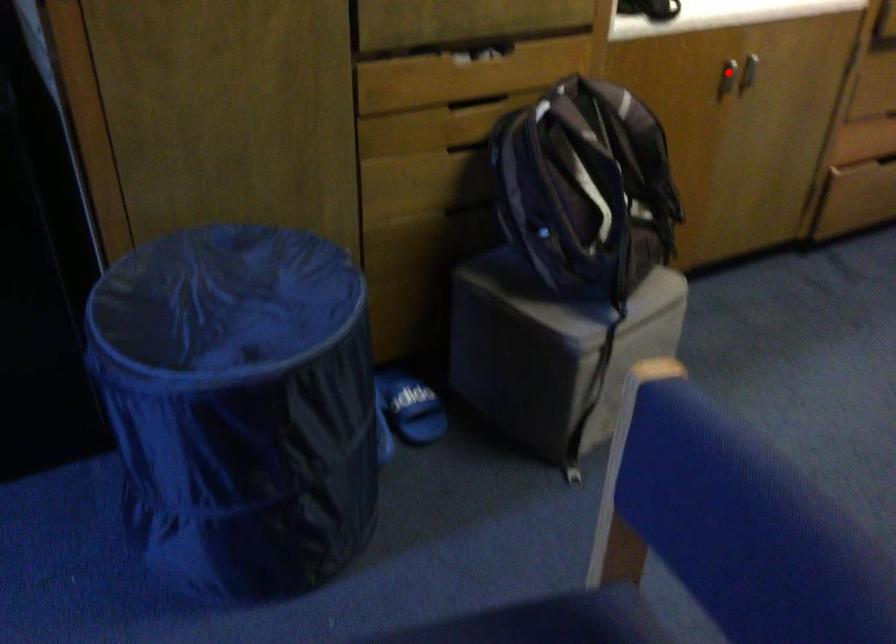
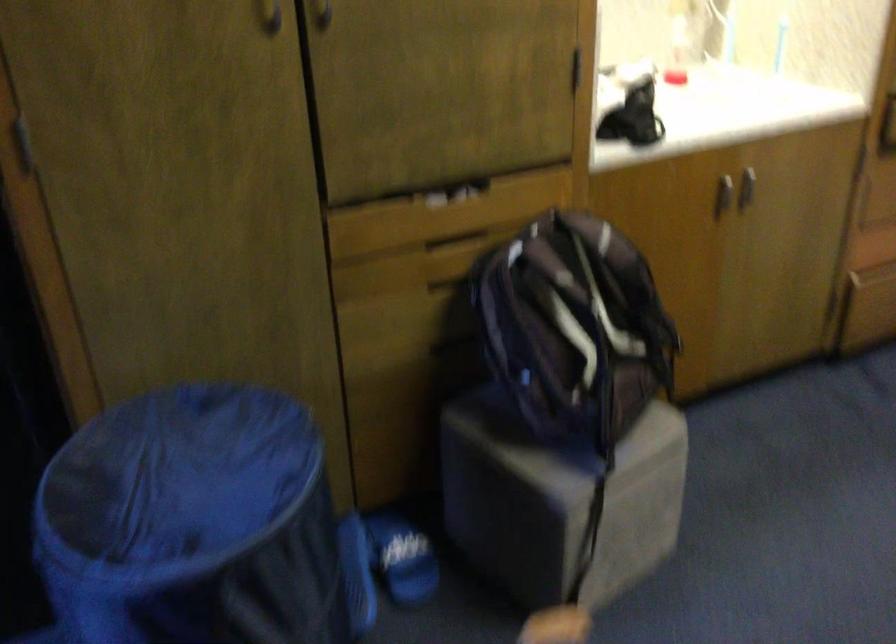
Where in the second image is the point corresponding to the highlighted location from the first image?

(722, 194)